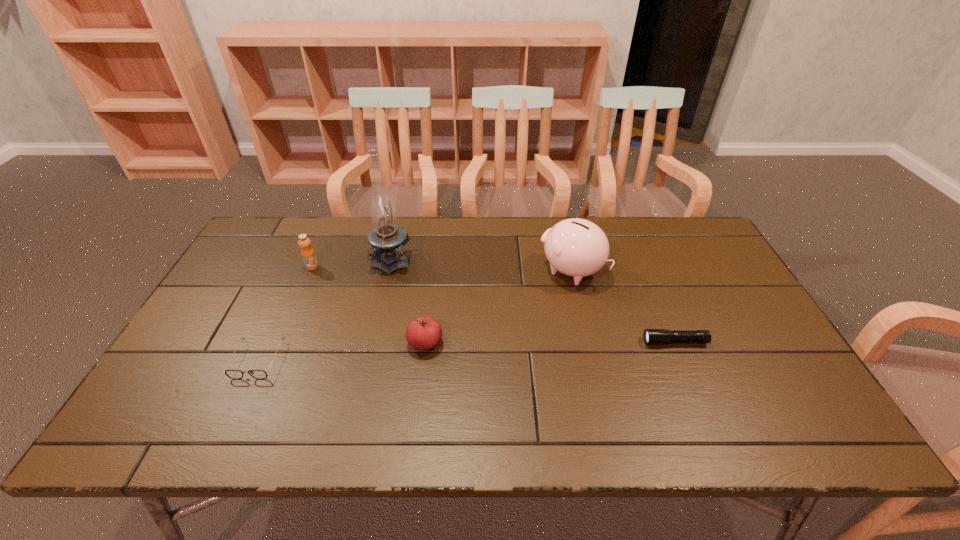
Image resolution: width=960 pixels, height=540 pixels. What are the coordinates of `the tallest object` in the screenshot? It's located at (386, 238).

Locate an element on the screen. the fourth object from right to left is located at coordinates (386, 238).

Find the location of a particular element. This screenshot has height=540, width=960. piggy bank is located at coordinates (576, 247).

This screenshot has height=540, width=960. What are the coordinates of `the fifth shortest object` in the screenshot? It's located at (576, 247).

You are a GUI agent. You are given a task and a screenshot of the screen. Output one action in this format:
    pyautogui.click(x=<x>, y=<y>)
    Task: Click on the third tallest object
    This screenshot has width=960, height=540.
    Given the screenshot: What is the action you would take?
    pyautogui.click(x=307, y=252)

The height and width of the screenshot is (540, 960). What are the coordinates of `the third shortest object` in the screenshot? It's located at (423, 333).

You are a GUI agent. You are given a task and a screenshot of the screen. Output one action in this format:
    pyautogui.click(x=<x>, y=<y>)
    Task: Click on the tomato
    The height and width of the screenshot is (540, 960).
    Given the screenshot: What is the action you would take?
    pyautogui.click(x=423, y=333)

This screenshot has height=540, width=960. Identify the location of the rightmost object. (651, 336).

Find the location of `sunglasses`. sunglasses is located at coordinates (233, 374).

You are a GUI agent. You are given a task and a screenshot of the screen. Output one action in this format:
    pyautogui.click(x=<x>, y=<y>)
    Task: Click on the vacant region located 0.050m on the back of the fourth object from right to left
    This screenshot has width=960, height=540.
    Given the screenshot: What is the action you would take?
    pyautogui.click(x=398, y=232)